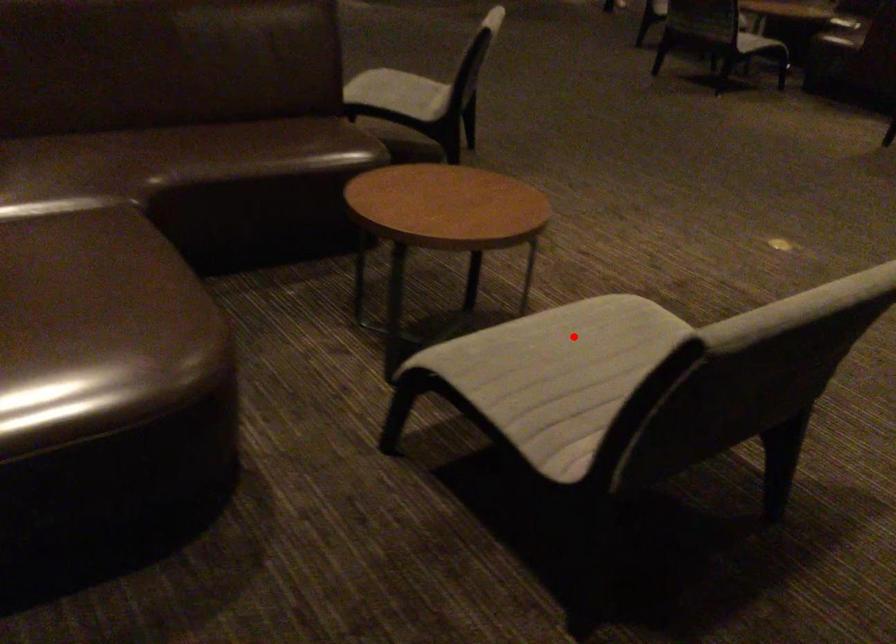
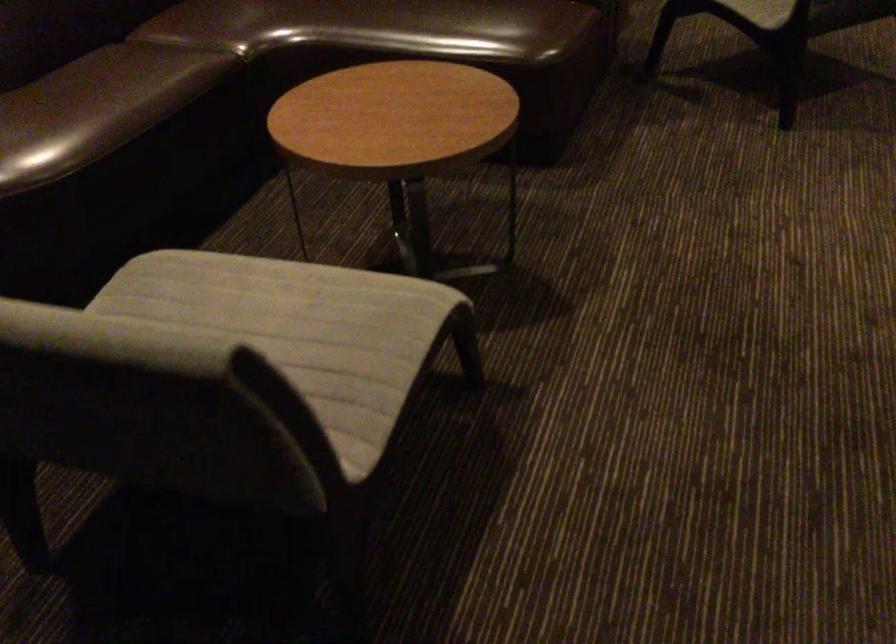
Question: I am providing you with two images of the same scene from different viewpoints. Given a red point in image1, look at the same physical point in image2. Is it:

Choices:
 (A) Closer to the viewpoint
 (B) Farther from the viewpoint

Answer: (A)